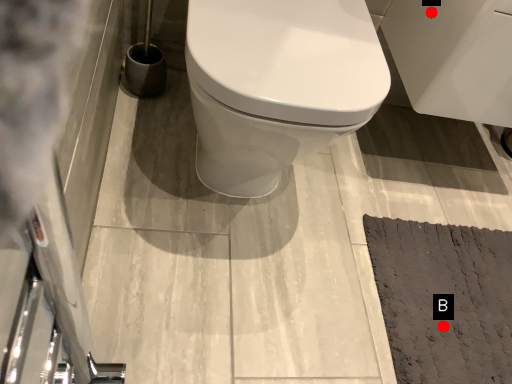
Question: Two points are circled on the image, labeled by A and B beside each circle. Which point is closer to the camera taking this photo?

Choices:
 (A) A is closer
 (B) B is closer

Answer: (A)